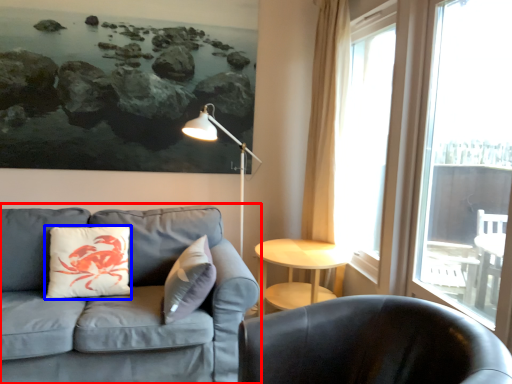
Question: Which point is further to the camera, studio couch (highlighted by a red box) or pillow (highlighted by a blue box)?

Choices:
 (A) studio couch
 (B) pillow

Answer: (B)